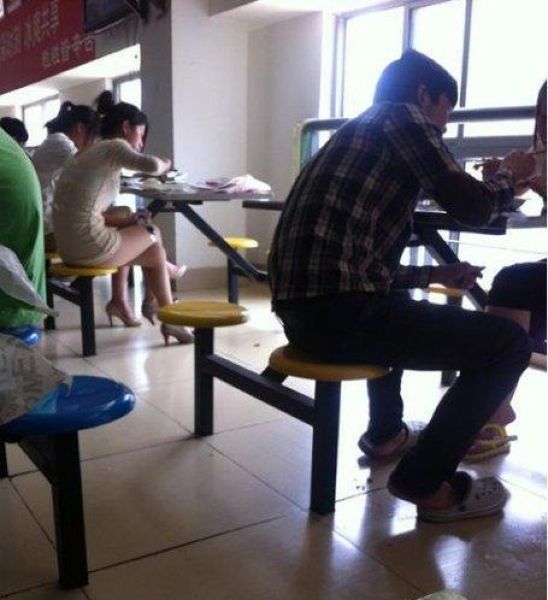
Image resolution: width=548 pixels, height=600 pixels. I want to click on cafeteria, so click(x=227, y=117).